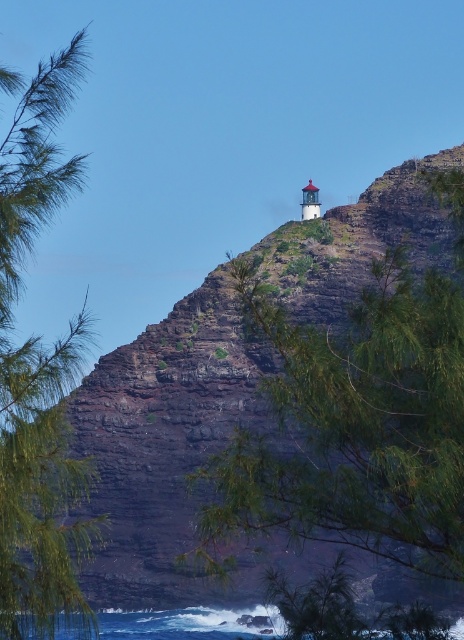
You are a hiker planning to descend from the green leafy tree at center to the blue water at lower center. Given that the average safe descent slope is 30 degrees, can you determine if the slope between them is safe based on the distance provided?

The distance between the green leafy tree at center and blue water at lower center is 30.59 meters. To determine if the slope is safe, we need to calculate the vertical drop. However, the provided information only includes horizontal distance. Without knowing the vertical elevation change, we cannot confirm if the slope angle meets the 30 degrees safety requirement.

You are an environmental scientist studying the vegetation on the cliff. You observe the green leafy tree at center and the green leafy tree at left. Which tree would you recommend measuring first if you want to prioritize taller vegetation for potential habitat analysis?

The green leafy tree at left is taller than the green leafy tree at center, so you should prioritize measuring the green leafy tree at left first for potential habitat analysis.

You are a photographer standing at the base of the cliff, aiming to capture the green leafy tree at center in your shot. Given that your camera has a maximum zoom range of 100 meters, will you be able to focus on the tree without moving closer?

The green leafy tree at center is 183.39 meters away from the camera. Since the camera can only zoom up to 100 meters, it cannot focus on the tree without moving closer.